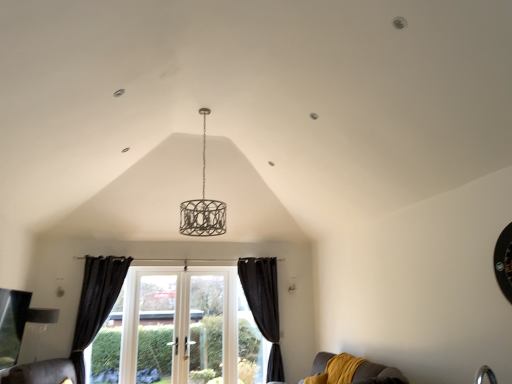
Question: Does velvet mustard couch at lower right appear on the right side of black velvet curtain at lower center, arranged as the second curtain when viewed from the left?

Choices:
 (A) no
 (B) yes

Answer: (B)

Question: Is velvet mustard couch at lower right placed right next to black velvet curtain at lower center, which ranks as the first curtain in right-to-left order?

Choices:
 (A) no
 (B) yes

Answer: (A)

Question: Is velvet mustard couch at lower right facing away from black velvet curtain at lower center, arranged as the second curtain when viewed from the left?

Choices:
 (A) yes
 (B) no

Answer: (B)

Question: Considering the relative sizes of velvet mustard couch at lower right and black velvet curtain at lower center, which ranks as the first curtain in right-to-left order, in the image provided, is velvet mustard couch at lower right taller than black velvet curtain at lower center, which ranks as the first curtain in right-to-left order,?

Choices:
 (A) no
 (B) yes

Answer: (A)

Question: From a real-world perspective, is velvet mustard couch at lower right over black velvet curtain at lower center, arranged as the second curtain when viewed from the left?

Choices:
 (A) yes
 (B) no

Answer: (B)

Question: Can you confirm if velvet mustard couch at lower right is positioned to the left of black velvet curtain at lower center, arranged as the second curtain when viewed from the left?

Choices:
 (A) yes
 (B) no

Answer: (B)

Question: Can you confirm if black velvet curtain at left, which appears as the first curtain when viewed from the left, is smaller than white glass door at center?

Choices:
 (A) no
 (B) yes

Answer: (B)

Question: Are black velvet curtain at left, which is counted as the second curtain, starting from the right, and white glass door at center far apart?

Choices:
 (A) yes
 (B) no

Answer: (B)

Question: Considering the relative sizes of black velvet curtain at left, which is counted as the second curtain, starting from the right, and white glass door at center in the image provided, is black velvet curtain at left, which is counted as the second curtain, starting from the right, shorter than white glass door at center?

Choices:
 (A) no
 (B) yes

Answer: (A)

Question: Is black velvet curtain at left, which is counted as the second curtain, starting from the right, surrounding white glass door at center?

Choices:
 (A) yes
 (B) no

Answer: (B)

Question: Is black velvet curtain at left, which appears as the first curtain when viewed from the left, to the left of white glass door at center from the viewer's perspective?

Choices:
 (A) no
 (B) yes

Answer: (B)

Question: Is black velvet curtain at left, which appears as the first curtain when viewed from the left, behind white glass door at center?

Choices:
 (A) no
 (B) yes

Answer: (A)

Question: Does matte silver lampshade at lower left have a lesser width compared to velvet mustard couch at lower right?

Choices:
 (A) no
 (B) yes

Answer: (B)